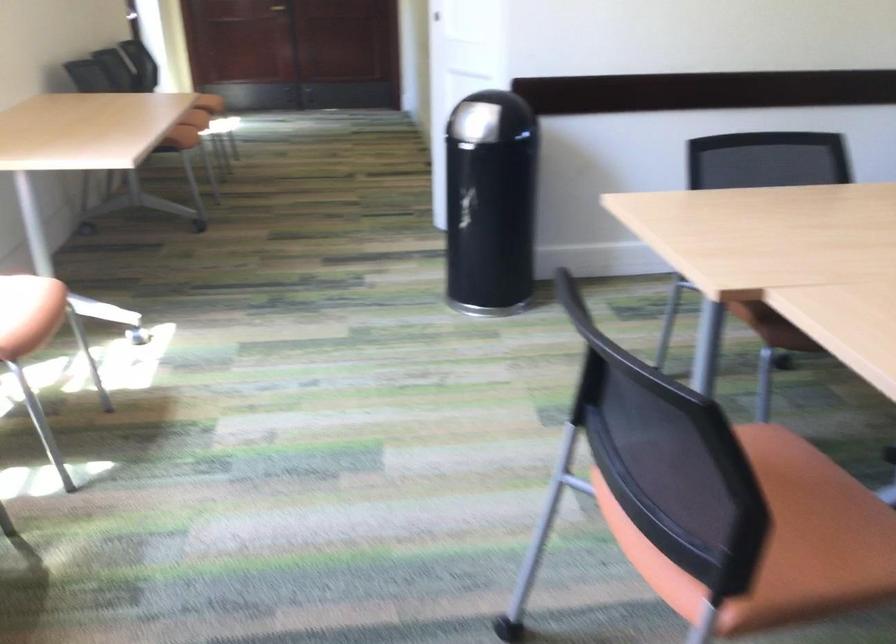
The width and height of the screenshot is (896, 644). Identify the location of trash can lid. (478, 122).